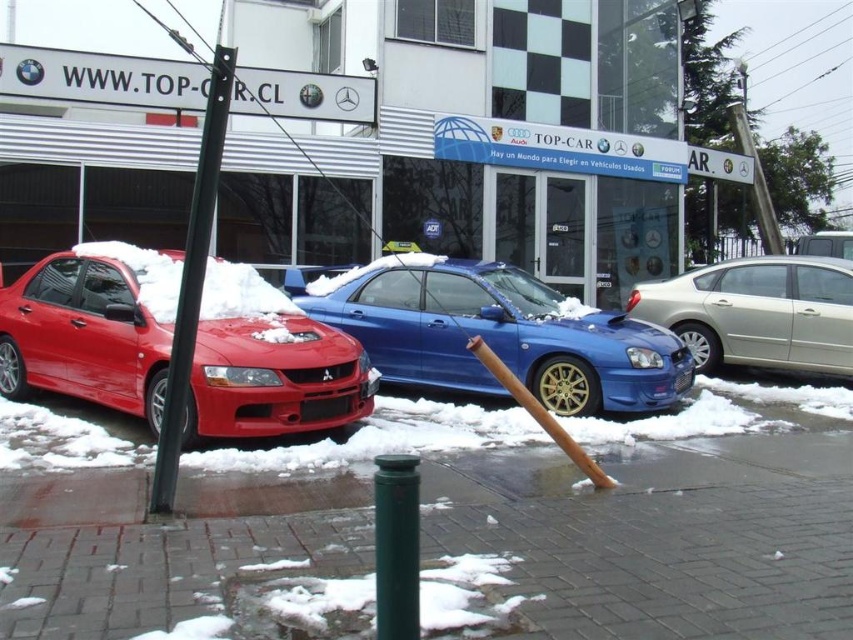
Question: Which object is farther from the camera taking this photo?

Choices:
 (A) green concrete sidewalk at lower center
 (B) silver metallic sedan at right
 (C) metallic blue car at center
 (D) black metal pole at left

Answer: (B)

Question: Which of the following is the farthest from the observer?

Choices:
 (A) matte red car at left
 (B) black metal pole at left

Answer: (A)

Question: Does green concrete sidewalk at lower center have a smaller size compared to metallic blue car at center?

Choices:
 (A) yes
 (B) no

Answer: (A)

Question: Does green matte pole at center appear over metallic silver sedan at center?

Choices:
 (A) yes
 (B) no

Answer: (B)

Question: Which point appears closest to the camera in this image?

Choices:
 (A) (816, 371)
 (B) (575, 392)
 (C) (804, 563)
 (D) (200, 280)

Answer: (C)

Question: Is matte red car at left positioned before metallic blue car at center?

Choices:
 (A) no
 (B) yes

Answer: (B)